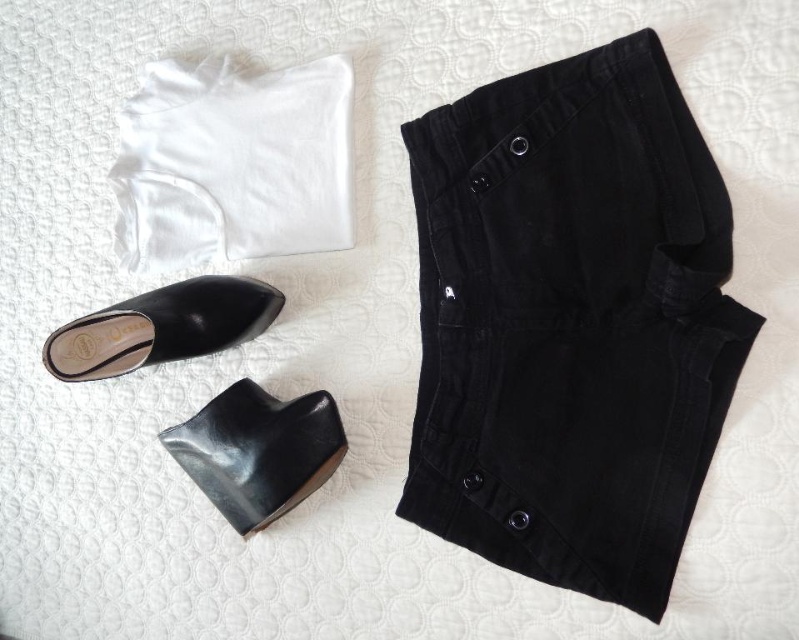
You are organizing a closet and see the black leather dress shoe at lower left and the black leather shoe at lower left. Which one is positioned more to the right?

The black leather dress shoe at lower left is positioned more to the right than the black leather shoe at lower left.